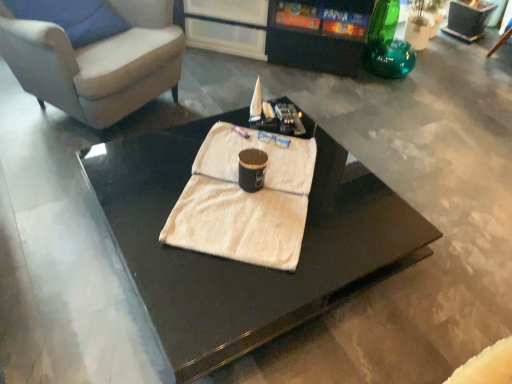
Question: Considering the positions of black glossy entertainment center at upper center and black glossy coffee table at center in the image, is black glossy entertainment center at upper center bigger or smaller than black glossy coffee table at center?

Choices:
 (A) small
 (B) big

Answer: (B)

Question: Based on their positions, is black glossy entertainment center at upper center located to the left or right of black glossy coffee table at center?

Choices:
 (A) left
 (B) right

Answer: (B)

Question: Which of these objects is positioned closest to the white textured towel at center?

Choices:
 (A) black glossy entertainment center at upper center
 (B) black glossy coffee table at center
 (C) suede-like beige armchair at upper left

Answer: (B)

Question: Considering the real-world distances, which object is closest to the white textured towel at center?

Choices:
 (A) black glossy entertainment center at upper center
 (B) black glossy coffee table at center
 (C) suede-like beige armchair at upper left

Answer: (B)